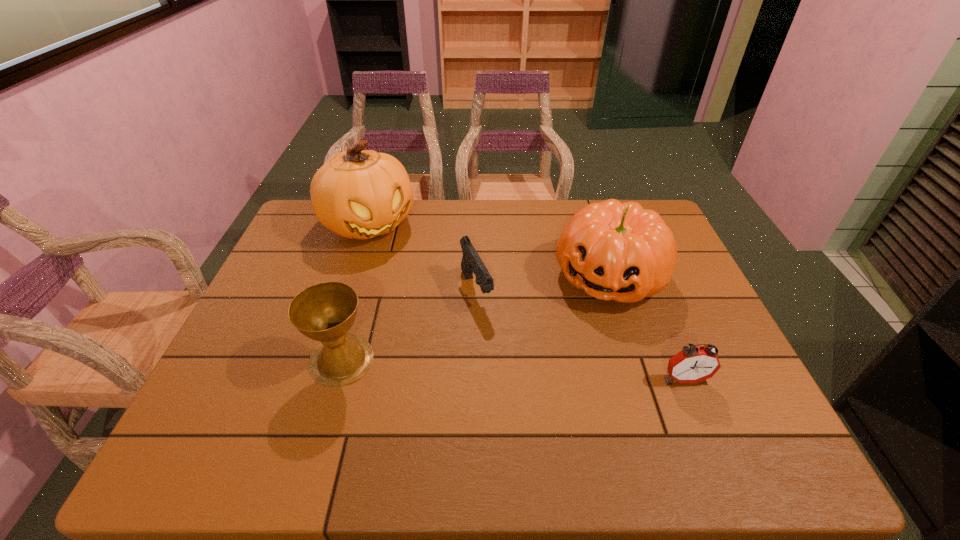
The width and height of the screenshot is (960, 540). Identify the location of vacant space positioned 0.200m on the carved face of the shorter pumpkin. 564,364.

The height and width of the screenshot is (540, 960). What are the coordinates of `vacant space positioned on the carved face of the shorter pumpkin` in the screenshot? It's located at (554, 383).

Where is `vacant space positioned on the carved face of the shorter pumpkin`? This screenshot has height=540, width=960. vacant space positioned on the carved face of the shorter pumpkin is located at coordinates (536, 419).

The image size is (960, 540). Find the location of `free space located at the barrel of the third object from left to right`. free space located at the barrel of the third object from left to right is located at coordinates (509, 363).

Locate an element on the screen. This screenshot has width=960, height=540. vacant space situated 0.120m at the barrel of the third object from left to right is located at coordinates (500, 347).

Locate an element on the screen. vacant space situated at the barrel of the third object from left to right is located at coordinates (529, 401).

Where is `chalice positioned at the near edge`? chalice positioned at the near edge is located at coordinates (325, 312).

The image size is (960, 540). What are the coordinates of `alarm clock that is at the near edge` in the screenshot? It's located at (693, 364).

Locate an element on the screen. This screenshot has width=960, height=540. object that is at the left edge is located at coordinates (356, 194).

This screenshot has width=960, height=540. Find the location of `alarm clock at the right edge`. alarm clock at the right edge is located at coordinates (693, 364).